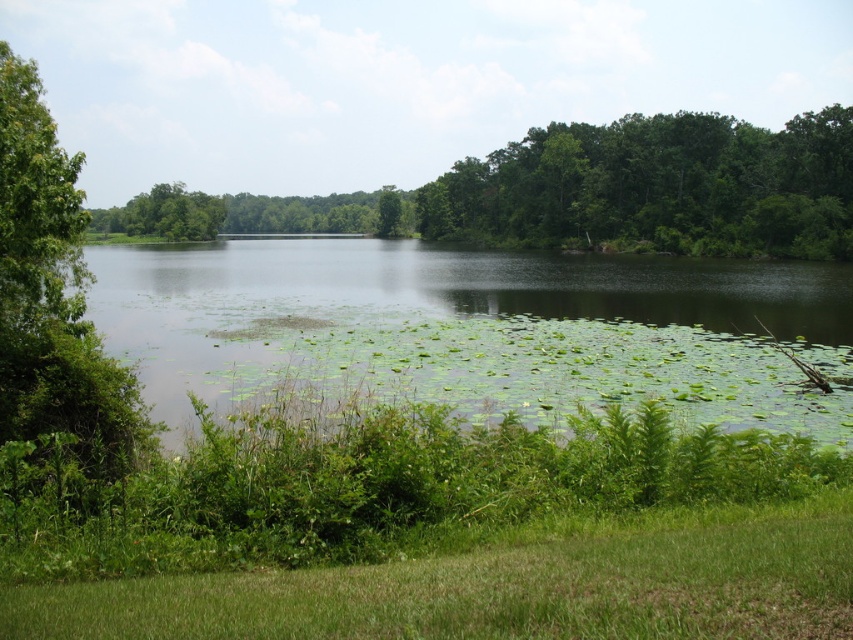
Question: Observing the image, what is the correct spatial positioning of green leafy water at center in reference to green leafy tree at center?

Choices:
 (A) above
 (B) below

Answer: (B)

Question: Does green leafy water at center appear on the right side of green leafy tree at center?

Choices:
 (A) no
 (B) yes

Answer: (B)

Question: Which point is closer to the camera taking this photo?

Choices:
 (A) (213, 301)
 (B) (822, 172)

Answer: (A)

Question: Is green leafy water at center wider than green leafy tree at center?

Choices:
 (A) yes
 (B) no

Answer: (B)

Question: Among these points, which one is nearest to the camera?

Choices:
 (A) (120, 289)
 (B) (694, 234)

Answer: (A)

Question: Which of the following is the closest to the observer?

Choices:
 (A) (631, 186)
 (B) (672, 321)

Answer: (B)